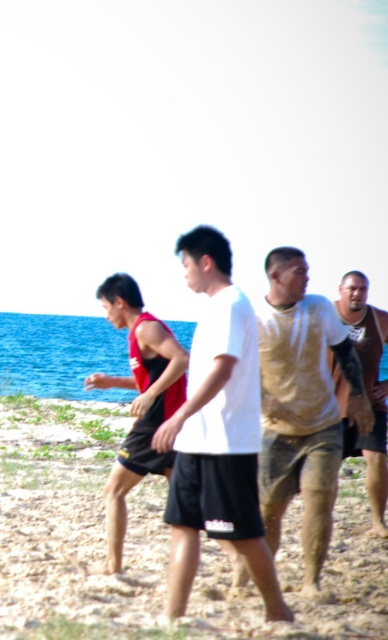
Question: Among these points, which one is nearest to the camera?

Choices:
 (A) (377, 464)
 (B) (150, 608)
 (C) (117, 522)

Answer: (B)

Question: Which of the following is the closest to the observer?

Choices:
 (A) (169, 371)
 (B) (325, 467)
 (C) (280, 561)

Answer: (B)

Question: Considering the relative positions of red fabric tank top at left and gold textured shirt at right in the image provided, where is red fabric tank top at left located with respect to gold textured shirt at right?

Choices:
 (A) left
 (B) right

Answer: (A)

Question: Is white matte t-shirt at center thinner than red fabric tank top at left?

Choices:
 (A) yes
 (B) no

Answer: (A)

Question: Considering the relative positions of gravelly sand at center and gold textured shirt at right in the image provided, where is gravelly sand at center located with respect to gold textured shirt at right?

Choices:
 (A) left
 (B) right

Answer: (A)

Question: Which point is farther to the camera?

Choices:
 (A) coord(374,310)
 (B) coord(116,480)
 (C) coord(315,625)

Answer: (A)